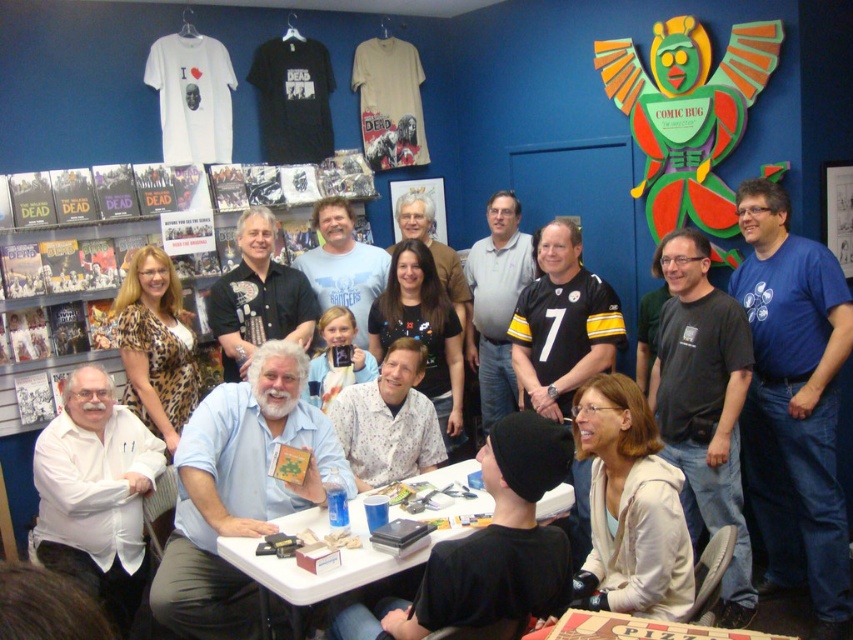
You are a store employee who needs to hand out a promotional flyer to both people wearing the black leather shirt at center and the black matte shirt at center. Since you can only approach one at a time, which one should you approach first based on their positions?

You should approach the black leather shirt at center first because it is closer to you than the black matte shirt at center.